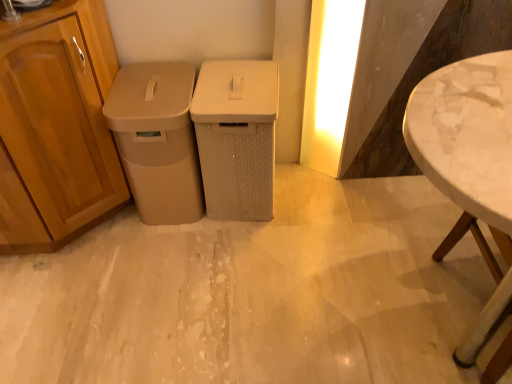
The width and height of the screenshot is (512, 384). What are the coordinates of `blank space to the left of white marble table at right` in the screenshot? It's located at (358, 303).